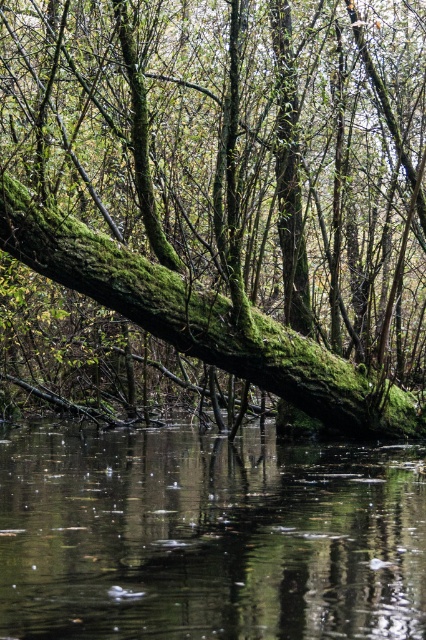
In the scene shown: You are a photographer trying to capture the green mossy log at center and the transparent water at center in a single shot. Based on their heights, which object will appear larger in the photo?

The green mossy log at center is taller than the transparent water at center, so it will appear larger in the photo.

You are a photographer planning to capture the green mossy log at center and the transparent water at center in a single frame. Based on the scene, which object would appear larger in the photo?

The green mossy log at center would appear larger in the photo because it is bigger than the transparent water at center according to the description.

You are a hiker who wants to cross the transparent water at center without getting your shoes wet. The green mossy log at center is in your path. Can you step onto the log to avoid the water?

Yes, you can step onto the green mossy log at center because it is closer to you than the transparent water at center, allowing you to use it as a crossing point.